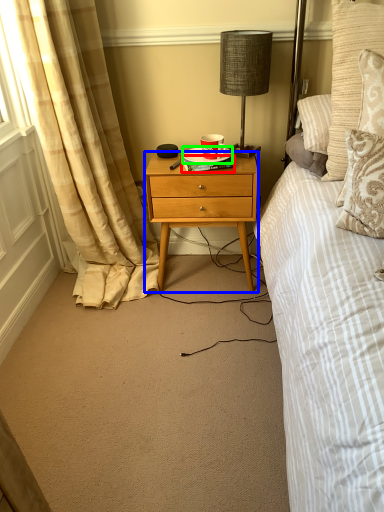
Question: Considering the real-world distances, which object is closest to book (highlighted by a red box)? desk (highlighted by a blue box) or plate (highlighted by a green box).

Choices:
 (A) desk
 (B) plate

Answer: (B)